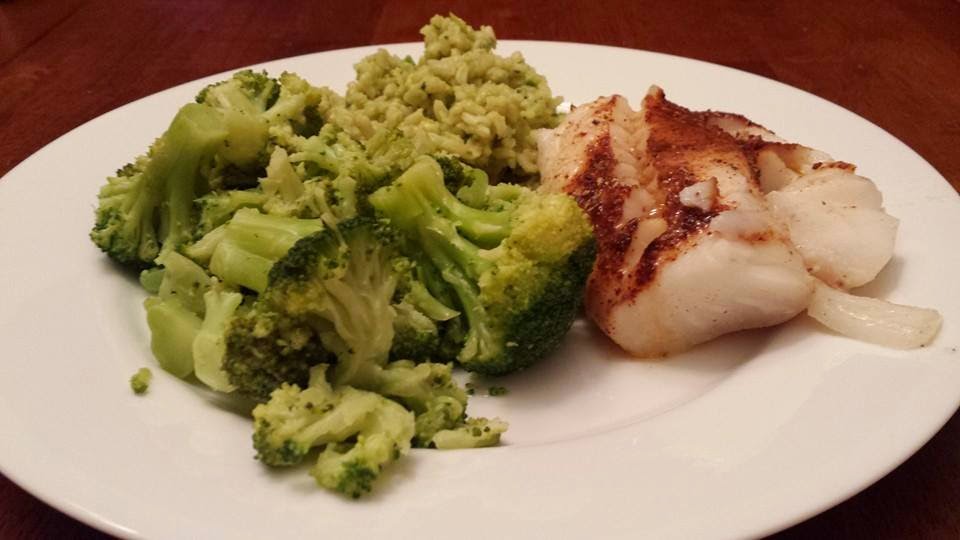
What are the coordinates of `table brown` in the screenshot? It's located at (854, 62).